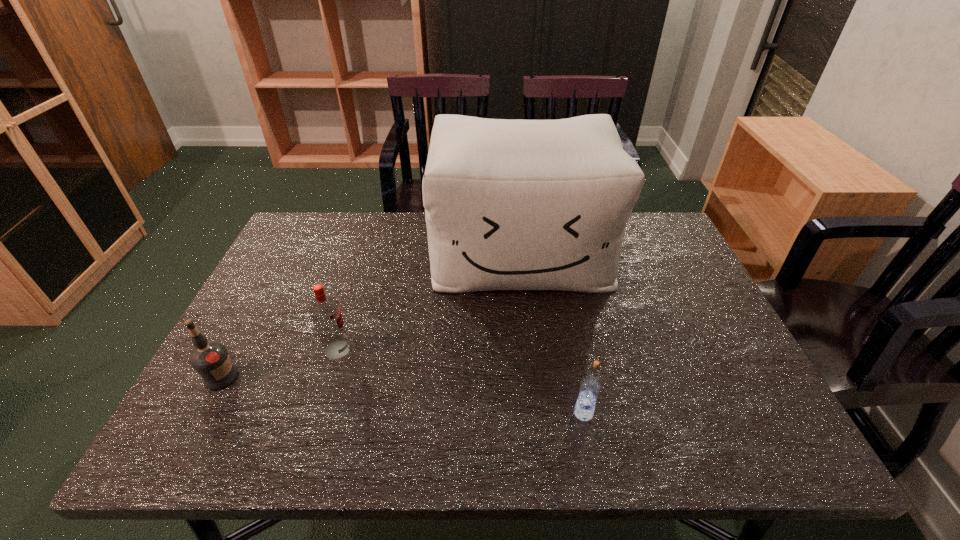
In the image, there is a desktop. Find the location of `vacant space at the near right corner`. vacant space at the near right corner is located at coordinates (716, 438).

Locate an element on the screen. The height and width of the screenshot is (540, 960). vacant area that lies between the second farthest vodka and the rightmost vodka is located at coordinates (402, 395).

I want to click on free space between the nearest vodka and the second vodka from left to right, so (461, 381).

Find the location of a particular element. unoccupied area between the tallest object and the nearest object is located at coordinates (552, 333).

The image size is (960, 540). Find the location of `vacant area that lies between the second nearest vodka and the rightmost vodka`. vacant area that lies between the second nearest vodka and the rightmost vodka is located at coordinates (402, 395).

The image size is (960, 540). What are the coordinates of `free space between the second vodka from left to right and the leftmost object` in the screenshot? It's located at (279, 364).

This screenshot has height=540, width=960. I want to click on vacant area that lies between the nearest object and the farthest vodka, so click(x=461, y=381).

This screenshot has width=960, height=540. In order to click on vacant area that lies between the rightmost vodka and the leftmost object in this screenshot , I will do `click(402, 395)`.

The width and height of the screenshot is (960, 540). I want to click on blank region between the third object from right to left and the cushion, so click(x=429, y=301).

Locate an element on the screen. vacant area that lies between the second farthest object and the cushion is located at coordinates (429, 301).